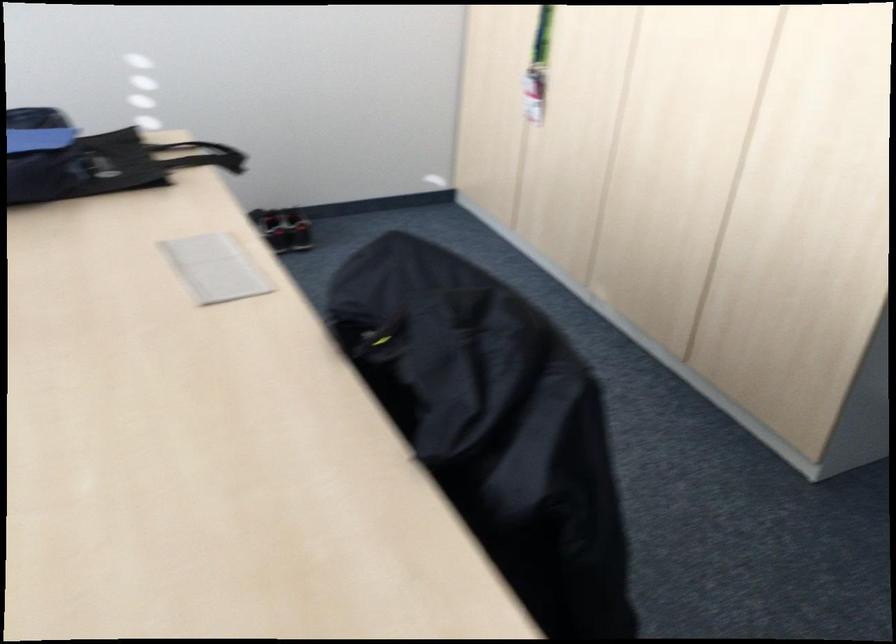
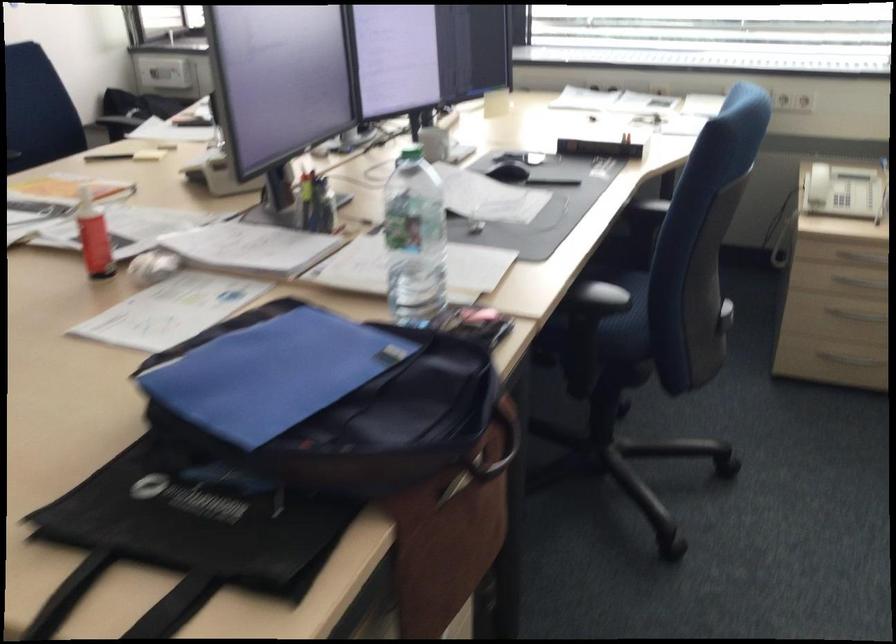
The point at (171, 155) is marked in the first image. Where is the corresponding point in the second image?

(124, 601)